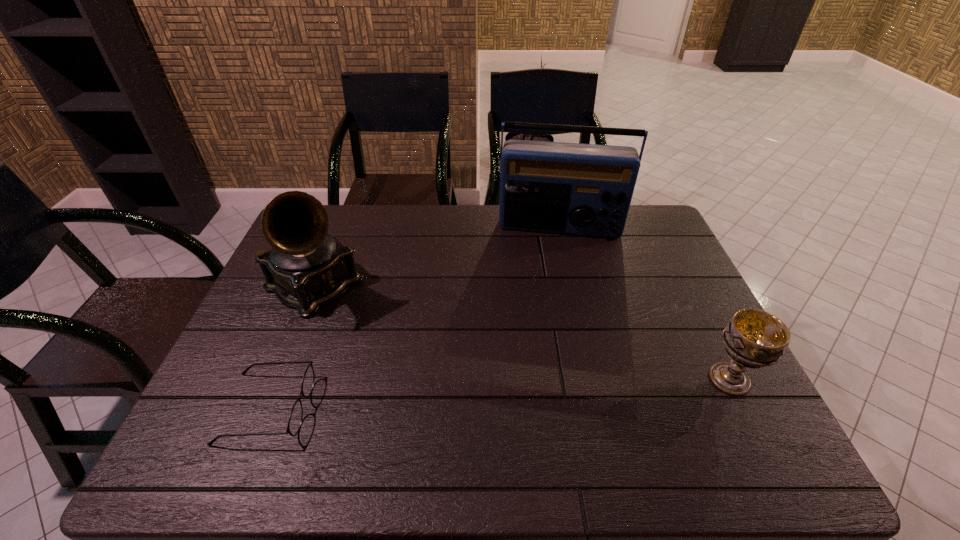
Find the location of a particular element. The width and height of the screenshot is (960, 540). free spot on the desktop that is between the shortest object and the chalice and is positioned on the horn of the second farthest object is located at coordinates (474, 395).

You are a GUI agent. You are given a task and a screenshot of the screen. Output one action in this format:
    pyautogui.click(x=<x>, y=<y>)
    Task: Click on the free space on the desktop that is between the spectacles and the chalice and is positioned on the front panel of the third object from left to right
    Image resolution: width=960 pixels, height=540 pixels.
    Given the screenshot: What is the action you would take?
    pyautogui.click(x=557, y=390)